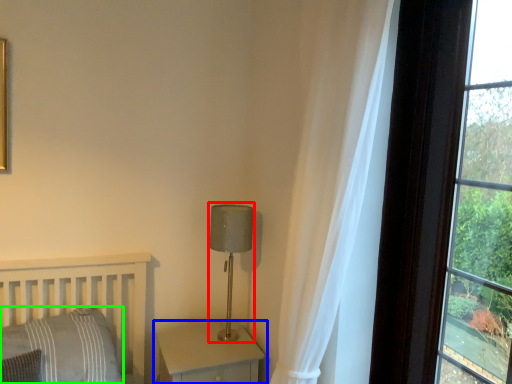
Question: Which object is the closest to the table lamp (highlighted by a red box)? Choose among these: nightstand (highlighted by a blue box) or pillow (highlighted by a green box).

Choices:
 (A) nightstand
 (B) pillow

Answer: (A)